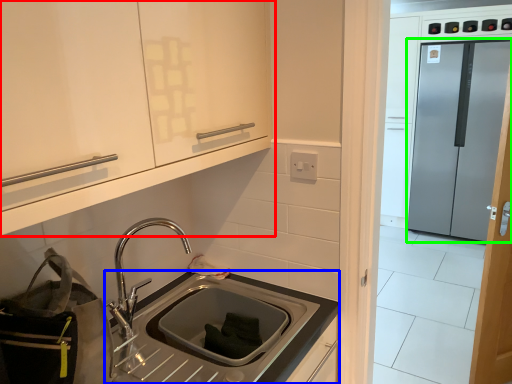
Question: Based on their relative distances, which object is nearer to cabinetry (highlighted by a red box)? Choose from countertop (highlighted by a blue box) and glass door (highlighted by a green box).

Choices:
 (A) countertop
 (B) glass door

Answer: (A)